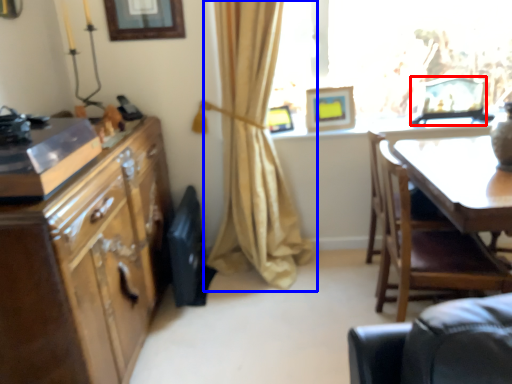
Question: Which point is further to the camera, picture frame (highlighted by a red box) or curtain (highlighted by a blue box)?

Choices:
 (A) picture frame
 (B) curtain

Answer: (A)